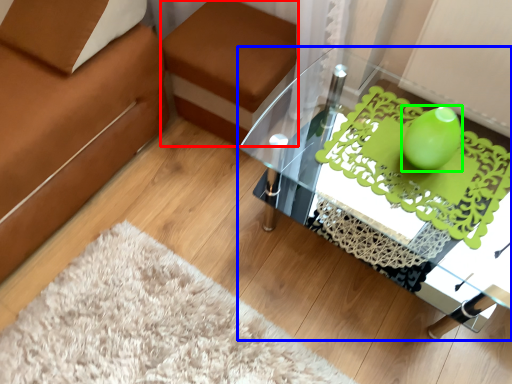
Question: Which is nearer to the footrest (highlighted by a red box)? table (highlighted by a blue box) or teal (highlighted by a green box).

Choices:
 (A) table
 (B) teal

Answer: (A)